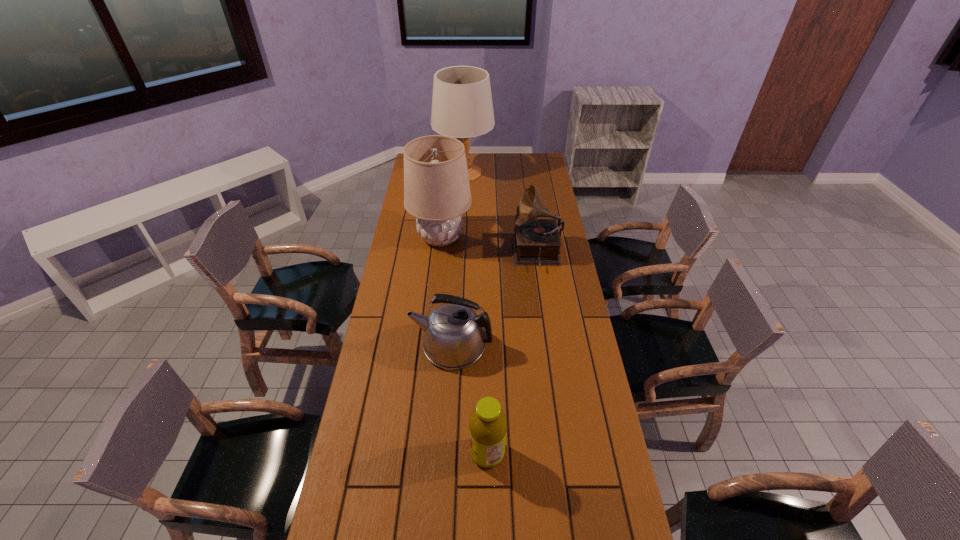
Where is `object positioned at the right edge`? The image size is (960, 540). object positioned at the right edge is located at coordinates (536, 242).

The image size is (960, 540). What are the coordinates of `object located at the far left corner` in the screenshot? It's located at (462, 107).

Image resolution: width=960 pixels, height=540 pixels. What are the coordinates of `vacant space at the left edge` in the screenshot? It's located at (419, 261).

This screenshot has height=540, width=960. I want to click on vacant space at the right edge of the desktop, so click(566, 258).

In order to click on vacant space at the far right corner of the desktop in this screenshot , I will do `click(542, 160)`.

Locate an element on the screen. The image size is (960, 540). free spot between the record player and the kettle is located at coordinates (494, 300).

Locate an element on the screen. empty space that is in between the farthest object and the second nearest object is located at coordinates (458, 259).

Identify the location of empty space between the record player and the second nearest object. (494, 300).

Locate an element on the screen. This screenshot has width=960, height=540. free space between the nearest object and the third shortest object is located at coordinates (512, 354).

The height and width of the screenshot is (540, 960). I want to click on free space between the kettle and the fruit juice, so click(x=470, y=400).